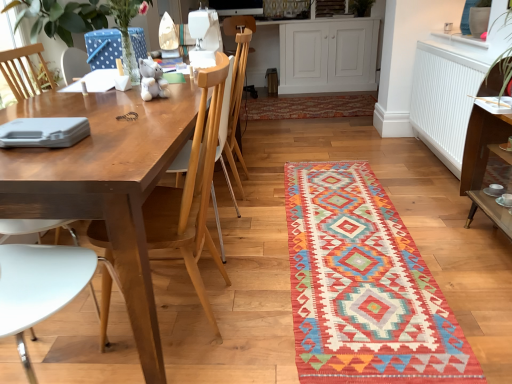
Question: Based on their sizes in the image, would you say wooden chair at center is bigger or smaller than multicolored woven mat at center?

Choices:
 (A) big
 (B) small

Answer: (A)

Question: From the image's perspective, relative to multicolored woven mat at center, is wooden chair at center above or below?

Choices:
 (A) above
 (B) below

Answer: (A)

Question: Which object is positioned closest to the wooden chair at center?

Choices:
 (A) white wood cabinet at upper center
 (B) white matte radiator at upper right
 (C) wooden chair at left
 (D) multicolored woven mat at center

Answer: (C)

Question: Which is farther from the wooden chair at left?

Choices:
 (A) multicolored woven mat at center
 (B) white wood cabinet at upper center
 (C) wooden chair at center
 (D) white matte radiator at upper right

Answer: (B)